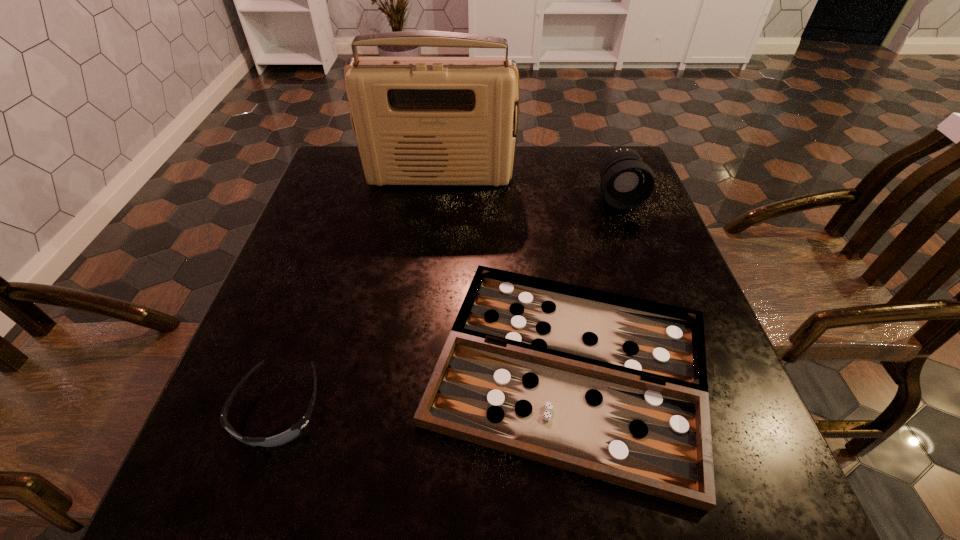
Image resolution: width=960 pixels, height=540 pixels. I want to click on free spot at the far edge of the desktop, so 565,175.

Where is `vacant space at the near edge of the desktop`? vacant space at the near edge of the desktop is located at coordinates (461, 476).

In order to click on free space at the left edge in this screenshot , I will do `click(198, 449)`.

Find the location of `free spot at the right edge of the desktop`. free spot at the right edge of the desktop is located at coordinates (616, 233).

The width and height of the screenshot is (960, 540). Identify the location of free point between the gameboard and the telephoto lens. (594, 282).

Image resolution: width=960 pixels, height=540 pixels. Find the location of `free space between the shortest object and the telephoto lens`. free space between the shortest object and the telephoto lens is located at coordinates (594, 282).

Where is `free space between the sunglasses and the radio receiver`? This screenshot has height=540, width=960. free space between the sunglasses and the radio receiver is located at coordinates (359, 293).

This screenshot has height=540, width=960. Identify the location of vacant region between the sunglasses and the tallest object. (359, 293).

You are a GUI agent. You are given a task and a screenshot of the screen. Output one action in this format:
    pyautogui.click(x=<x>, y=<y>)
    Task: Click on the vacant space that is in between the second tallest object and the sunglasses
    The height and width of the screenshot is (540, 960).
    Given the screenshot: What is the action you would take?
    pyautogui.click(x=448, y=303)

Find the location of a particular element. The width and height of the screenshot is (960, 540). vacant area between the gameboard and the telephoto lens is located at coordinates (594, 282).